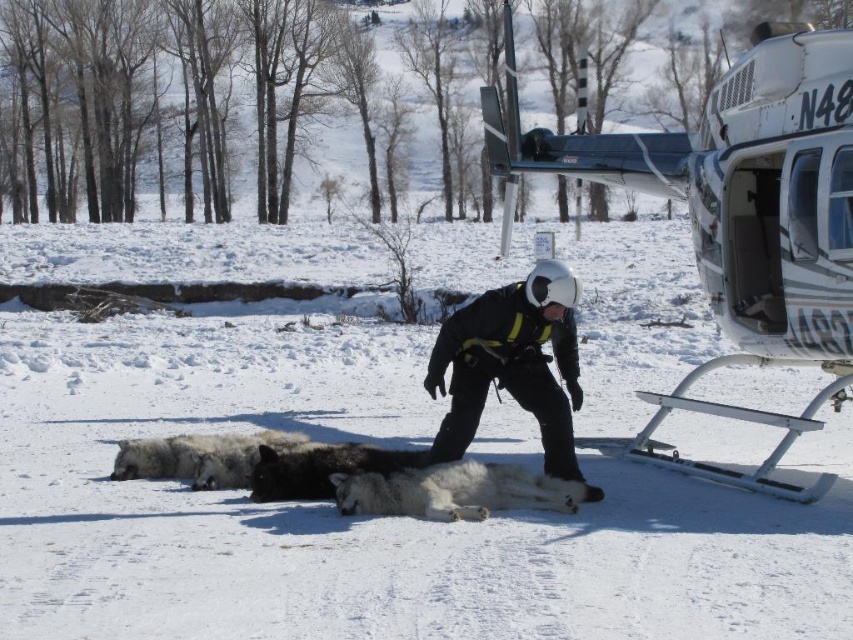
You are a wildlife researcher observing two dogs in the snow. You notice a white fluffy dog at center and a black fur dog at center. Which dog is positioned to the right of the other?

The white fluffy dog at center is to the right of the black fur dog at center.

Looking at this image, you are a wildlife researcher observing two dogs in the snow. You notice a white fluffy dog at center and a black fur dog at center. Which dog is positioned closer to you?

The white fluffy dog at center is closer to the viewer than the black fur dog at center.

You are a wildlife researcher standing in the snowy area. You need to place a tracking device on the white fluffy snow at center. The device has a maximum range of 5 meters. Can you place it from your current position?

The white fluffy snow at center is 4.91 meters from camera. Since the device has a maximum range of 5 meters, you can place it from your current position.